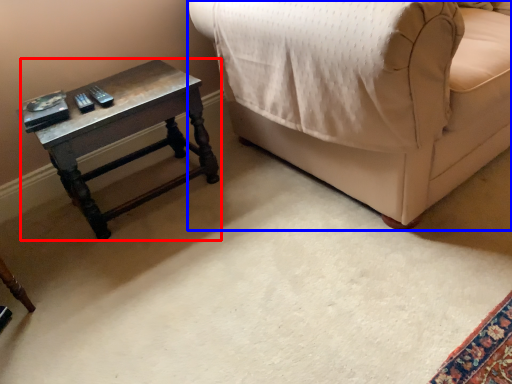
Question: Which object appears farthest to the camera in this image, table (highlighted by a red box) or furniture (highlighted by a blue box)?

Choices:
 (A) table
 (B) furniture

Answer: (A)